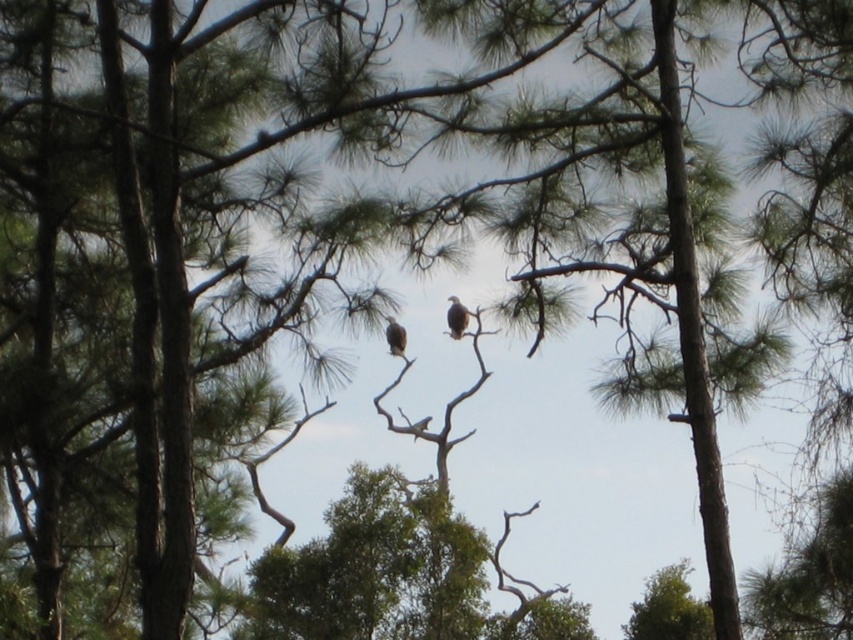
Question: Among these points, which one is farthest from the camera?

Choices:
 (A) (456, 304)
 (B) (390, 324)

Answer: (A)

Question: Can you confirm if brown feathered bird at center is smaller than brown feathered eagle at center?

Choices:
 (A) no
 (B) yes

Answer: (A)

Question: Is brown feathered bird at center behind brown feathered eagle at center?

Choices:
 (A) yes
 (B) no

Answer: (B)

Question: Is brown feathered bird at center positioned before brown feathered eagle at center?

Choices:
 (A) no
 (B) yes

Answer: (B)

Question: Which point is farther to the camera?

Choices:
 (A) brown feathered bird at center
 (B) brown feathered eagle at center

Answer: (B)